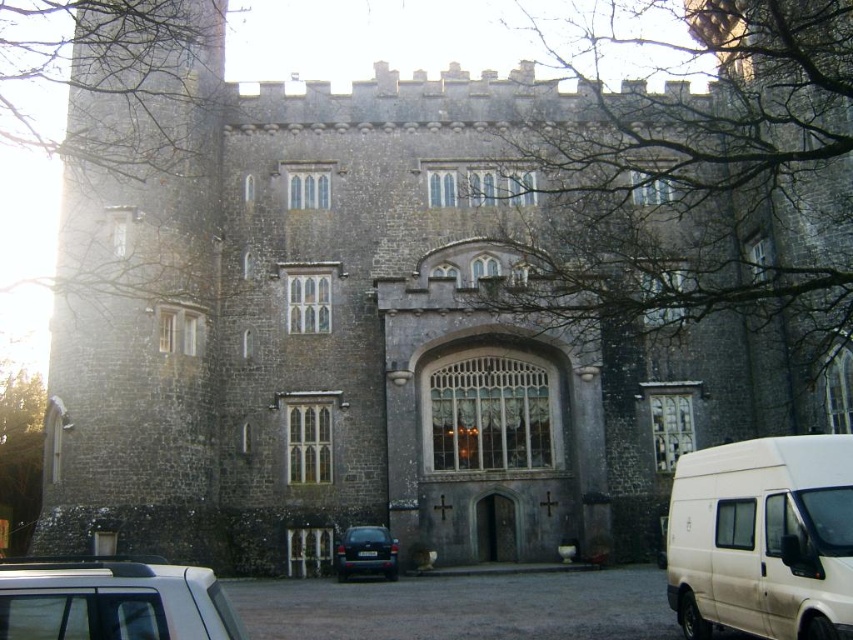
Which is below, silver metallic car at lower left or dark blue matte car at lower center?

dark blue matte car at lower center

The height and width of the screenshot is (640, 853). Identify the location of silver metallic car at lower left. (113, 602).

Which is in front, point (194, 572) or point (392, 541)?

Point (194, 572) is more forward.

Image resolution: width=853 pixels, height=640 pixels. I want to click on silver metallic car at lower left, so click(x=113, y=602).

Does white matte van at lower right appear over silver metallic car at lower left?

No.

Can you confirm if white matte van at lower right is positioned to the right of silver metallic car at lower left?

Correct, you'll find white matte van at lower right to the right of silver metallic car at lower left.

Does point (791, 531) come closer to viewer compared to point (85, 611)?

No, it is behind (85, 611).

The image size is (853, 640). I want to click on white matte van at lower right, so click(763, 538).

Which is in front, point (737, 504) or point (351, 573)?

Point (737, 504)

This screenshot has height=640, width=853. What are the coordinates of `white matte van at lower right` in the screenshot? It's located at click(x=763, y=538).